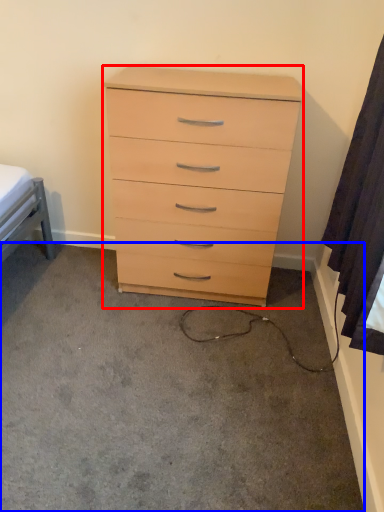
Question: Which of the following is the farthest to the observer, chest of drawers (highlighted by a red box) or concrete (highlighted by a blue box)?

Choices:
 (A) chest of drawers
 (B) concrete

Answer: (A)